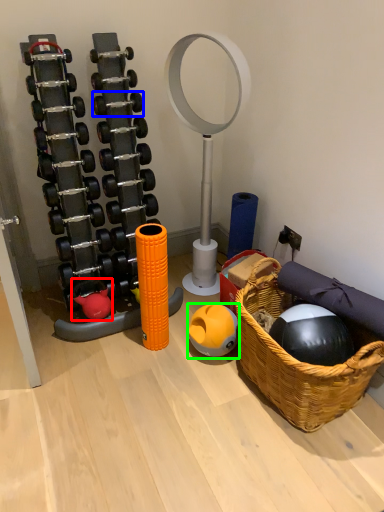
Question: Which object is the farthest from toy (highlighted by a red box)? Choose among these: dumbbell (highlighted by a blue box) or ball (highlighted by a green box).

Choices:
 (A) dumbbell
 (B) ball

Answer: (A)